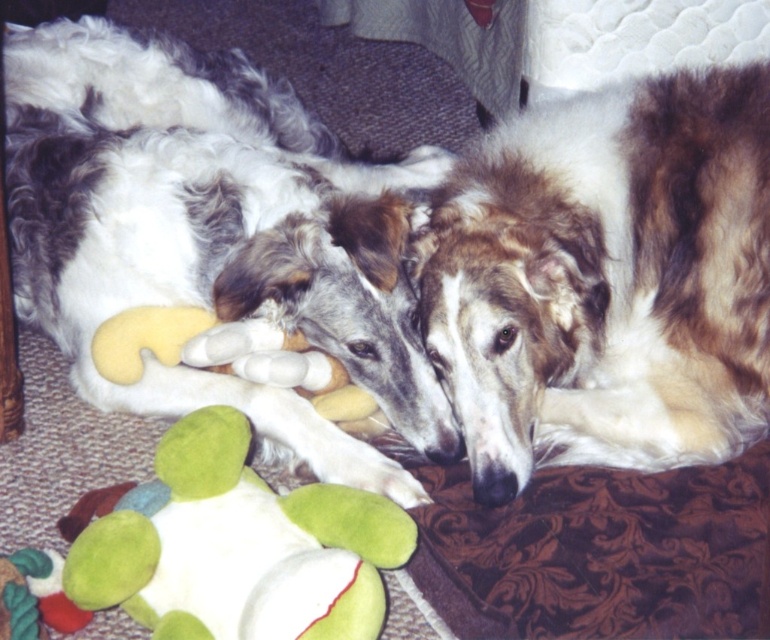
Question: Which point appears farthest from the camera in this image?

Choices:
 (A) (316, 556)
 (B) (628, 218)

Answer: (B)

Question: Does soft plush dog at center have a larger size compared to green plush toy at center?

Choices:
 (A) no
 (B) yes

Answer: (B)

Question: Which of the following is the farthest from the observer?

Choices:
 (A) (132, 508)
 (B) (362, 339)

Answer: (B)

Question: Can you confirm if soft plush dog at center is positioned to the left of green plush toy at center?

Choices:
 (A) no
 (B) yes

Answer: (B)

Question: Which point is farther from the camera taking this photo?

Choices:
 (A) (129, 540)
 (B) (641, 81)
 (C) (39, 184)

Answer: (C)

Question: Is brown shaggy dog at center behind green plush toy at center?

Choices:
 (A) yes
 (B) no

Answer: (A)